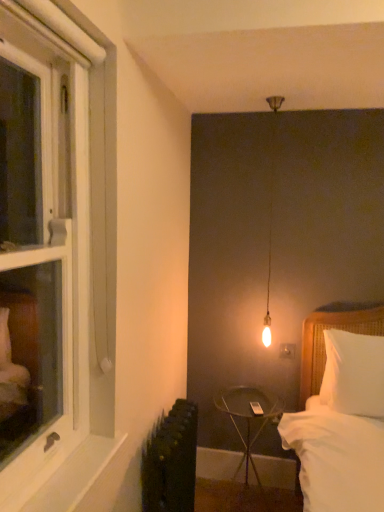
Where is `vacant area on top of white painted wood at lower left (from a real-world perspective)`? vacant area on top of white painted wood at lower left (from a real-world perspective) is located at coordinates (77, 458).